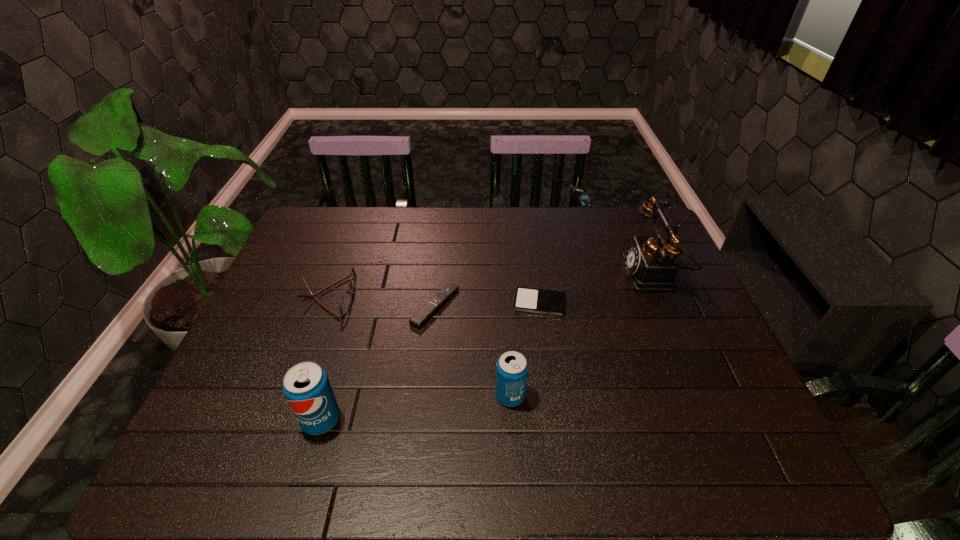
Find the location of `object that is at the right edge`. object that is at the right edge is located at coordinates (650, 262).

Locate an element on the screen. object present at the far right corner is located at coordinates [x=650, y=262].

This screenshot has width=960, height=540. I want to click on vacant position at the far edge of the desktop, so click(x=573, y=210).

Where is `free space at the near edge`? free space at the near edge is located at coordinates (638, 425).

The image size is (960, 540). In order to click on blank space at the left edge of the desktop in this screenshot , I will do `click(254, 369)`.

In the image, there is a desktop. Where is `vacant space at the right edge`? vacant space at the right edge is located at coordinates (682, 278).

The width and height of the screenshot is (960, 540). In order to click on free spot at the far left corner of the desktop in this screenshot , I will do `click(339, 208)`.

The height and width of the screenshot is (540, 960). Identify the location of free space at the far right corner. (631, 214).

Find the location of a particular element. vacant space that is in between the left soda can and the fourth shortest object is located at coordinates (416, 408).

What are the coordinates of `unoccupied area between the right soda can and the fourth object from right to left` in the screenshot? It's located at (472, 351).